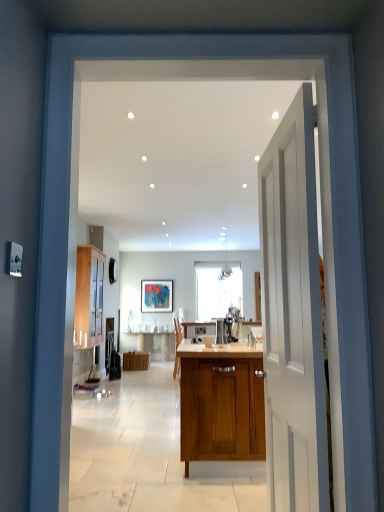
Describe the element at coordinates (89, 297) in the screenshot. I see `wooden cabinet at left, the first cabinetry viewed from the top` at that location.

What do you see at coordinates (136, 361) in the screenshot?
I see `wooden cabinet at center, positioned as the 1th cabinetry in back-to-front order` at bounding box center [136, 361].

This screenshot has height=512, width=384. I want to click on wooden cabinet at left, which ranks as the first cabinetry in left-to-right order, so 89,297.

Looking at this image, would you say wooden cabinet at center, which appears as the second cabinetry when viewed from the left, is inside or outside wooden cabinet at left, placed as the 1th cabinetry when sorted from front to back?

wooden cabinet at center, which appears as the second cabinetry when viewed from the left, cannot be found inside wooden cabinet at left, placed as the 1th cabinetry when sorted from front to back.

Is wooden cabinet at center, which appears as the second cabinetry when viewed from the left, not near wooden cabinet at left, the first cabinetry viewed from the top?

Yes, wooden cabinet at center, which appears as the second cabinetry when viewed from the left, is far from wooden cabinet at left, the first cabinetry viewed from the top.

From the image's perspective, is wooden cabinet at center, the first cabinetry when ordered from bottom to top, above or below wooden cabinet at left, which ranks as the first cabinetry in left-to-right order?

wooden cabinet at center, the first cabinetry when ordered from bottom to top, is situated lower than wooden cabinet at left, which ranks as the first cabinetry in left-to-right order, in the image.

How much distance is there between wooden cabinet at left, the first cabinetry viewed from the top, and satin silver coffee machine at center?

They are 3.30 meters apart.

Considering the relative positions of wooden cabinet at left, the first cabinetry viewed from the top, and satin silver coffee machine at center in the image provided, is wooden cabinet at left, the first cabinetry viewed from the top, to the left or to the right of satin silver coffee machine at center?

Based on their positions, wooden cabinet at left, the first cabinetry viewed from the top, is located to the left of satin silver coffee machine at center.

In the scene shown: Is wooden cabinet at left, which ranks as the first cabinetry in left-to-right order, far from satin silver coffee machine at center?

Indeed, wooden cabinet at left, which ranks as the first cabinetry in left-to-right order, is not near satin silver coffee machine at center.

The width and height of the screenshot is (384, 512). I want to click on the 1st cabinetry behind the satin silver coffee machine at center, starting your count from the anchor, so click(89, 297).

Can you confirm if white smooth door at right is positioned to the right of satin silver coffee machine at center?

Yes.

Is white smooth door at right oriented away from satin silver coffee machine at center?

No, white smooth door at right is not facing away from satin silver coffee machine at center.

Looking at their sizes, would you say white smooth door at right is wider or thinner than satin silver coffee machine at center?

In the image, white smooth door at right appears to be more narrow than satin silver coffee machine at center.

Does wooden cabinet at center, the first cabinetry when ordered from bottom to top, touch white smooth door at right?

No, wooden cabinet at center, the first cabinetry when ordered from bottom to top, is not next to white smooth door at right.

Is wooden cabinet at center, positioned as the 1th cabinetry in back-to-front order, bigger than white smooth door at right?

No, wooden cabinet at center, positioned as the 1th cabinetry in back-to-front order, is not bigger than white smooth door at right.

This screenshot has width=384, height=512. Identify the location of door in front of the wooden cabinet at center, which is the second cabinetry from top to bottom. (292, 316).

Can wooden cabinet at left, the second cabinetry when ordered from bottom to top, be found inside white smooth door at right?

No, white smooth door at right does not contain wooden cabinet at left, the second cabinetry when ordered from bottom to top.

Could you measure the distance between white smooth door at right and wooden cabinet at left, which ranks as the first cabinetry in left-to-right order?

white smooth door at right is 5.03 meters from wooden cabinet at left, which ranks as the first cabinetry in left-to-right order.

In the scene shown: Considering the relative sizes of white smooth door at right and wooden cabinet at left, the second cabinetry from the back, in the image provided, is white smooth door at right thinner than wooden cabinet at left, the second cabinetry from the back,?

Correct, the width of white smooth door at right is less than that of wooden cabinet at left, the second cabinetry from the back.

From the picture: Is white smooth door at right facing away from wooden cabinet at left, the first cabinetry viewed from the top?

That's not correct — white smooth door at right is not looking away from wooden cabinet at left, the first cabinetry viewed from the top.

Is wooden cabinet at left, which ranks as the first cabinetry in left-to-right order, in front of or behind wooden cabinet at center, the first cabinetry when ordered from bottom to top, in the image?

Clearly, wooden cabinet at left, which ranks as the first cabinetry in left-to-right order, is in front of wooden cabinet at center, the first cabinetry when ordered from bottom to top.

Which of these two, wooden cabinet at left, which ranks as the first cabinetry in left-to-right order, or wooden cabinet at center, which is the second cabinetry from top to bottom, is thinner?

wooden cabinet at left, which ranks as the first cabinetry in left-to-right order.

Identify the location of cabinetry in front of the wooden cabinet at center, which appears as the 1th cabinetry when viewed from the right. This screenshot has width=384, height=512. (89, 297).

From a real-world perspective, does satin silver coffee machine at center sit lower than white smooth door at right?

Yes, from a real-world perspective, satin silver coffee machine at center is below white smooth door at right.

Is satin silver coffee machine at center far from white smooth door at right?

Yes, satin silver coffee machine at center is far from white smooth door at right.

From the image's perspective, is satin silver coffee machine at center positioned above or below white smooth door at right?

satin silver coffee machine at center is situated lower than white smooth door at right in the image.

Does point (216, 332) lie in front of point (300, 102)?

No, it is not.

Identify the location of cabinetry that appears on the left of wooden cabinet at center, the first cabinetry when ordered from bottom to top. This screenshot has width=384, height=512. (89, 297).

Where is `appliance located on the right of wooden cabinet at left, which ranks as the first cabinetry in left-to-right order`? The width and height of the screenshot is (384, 512). appliance located on the right of wooden cabinet at left, which ranks as the first cabinetry in left-to-right order is located at coordinates (222, 331).

Looking at the image, which one is located further to wooden cabinet at left, the second cabinetry from the back, white smooth door at right or satin silver coffee machine at center?

white smooth door at right.

Considering their positions, is wooden cabinet at left, placed as the 1th cabinetry when sorted from front to back, positioned further to satin silver coffee machine at center than white smooth door at right?

wooden cabinet at left, placed as the 1th cabinetry when sorted from front to back, lies further to satin silver coffee machine at center than the other object.

In the scene shown: When comparing their distances from wooden cabinet at center, which appears as the 1th cabinetry when viewed from the right, does satin silver coffee machine at center or wooden cabinet at left, placed as the 1th cabinetry when sorted from front to back, seem further?

satin silver coffee machine at center is further to wooden cabinet at center, which appears as the 1th cabinetry when viewed from the right.

From the image, which object appears to be farther from wooden cabinet at center, which is the second cabinetry from top to bottom, satin silver coffee machine at center or white smooth door at right?

Among the two, white smooth door at right is located further to wooden cabinet at center, which is the second cabinetry from top to bottom.

Considering their positions, is wooden cabinet at left, the second cabinetry from the back, positioned closer to wooden cabinet at center, which appears as the second cabinetry when viewed from the left, than satin silver coffee machine at center?

wooden cabinet at left, the second cabinetry from the back, lies closer to wooden cabinet at center, which appears as the second cabinetry when viewed from the left, than the other object.

When comparing their distances from satin silver coffee machine at center, does wooden cabinet at center, positioned as the 1th cabinetry in back-to-front order, or white smooth door at right seem closer?

Based on the image, white smooth door at right appears to be nearer to satin silver coffee machine at center.

Estimate the real-world distances between objects in this image. Which object is closer to white smooth door at right, satin silver coffee machine at center or wooden cabinet at center, positioned as the second cabinetry in front-to-back order?

The object closer to white smooth door at right is satin silver coffee machine at center.

From the image, which object appears to be farther from wooden cabinet at left, the second cabinetry when ordered from bottom to top, white smooth door at right or wooden cabinet at center, the first cabinetry when ordered from bottom to top?

white smooth door at right is further to wooden cabinet at left, the second cabinetry when ordered from bottom to top.

Find the location of `appliance between white smooth door at right and wooden cabinet at center, which is the second cabinetry from top to bottom, in the front-back direction`. appliance between white smooth door at right and wooden cabinet at center, which is the second cabinetry from top to bottom, in the front-back direction is located at coordinates (222, 331).

Identify the location of cabinetry between white smooth door at right and wooden cabinet at center, which appears as the 1th cabinetry when viewed from the right, in the front-back direction. (89, 297).

I want to click on cabinetry positioned between satin silver coffee machine at center and wooden cabinet at center, positioned as the 1th cabinetry in back-to-front order, from near to far, so click(89, 297).

Image resolution: width=384 pixels, height=512 pixels. Identify the location of appliance between white smooth door at right and wooden cabinet at left, which ranks as the first cabinetry in left-to-right order, in the front-back direction. (222, 331).